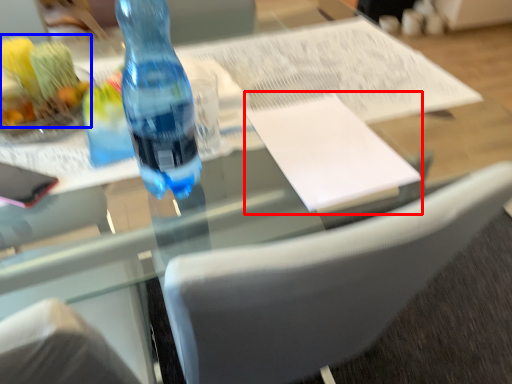
Question: Which object appears farthest to the camera in this image, journal (highlighted by a red box) or food (highlighted by a blue box)?

Choices:
 (A) journal
 (B) food

Answer: (A)